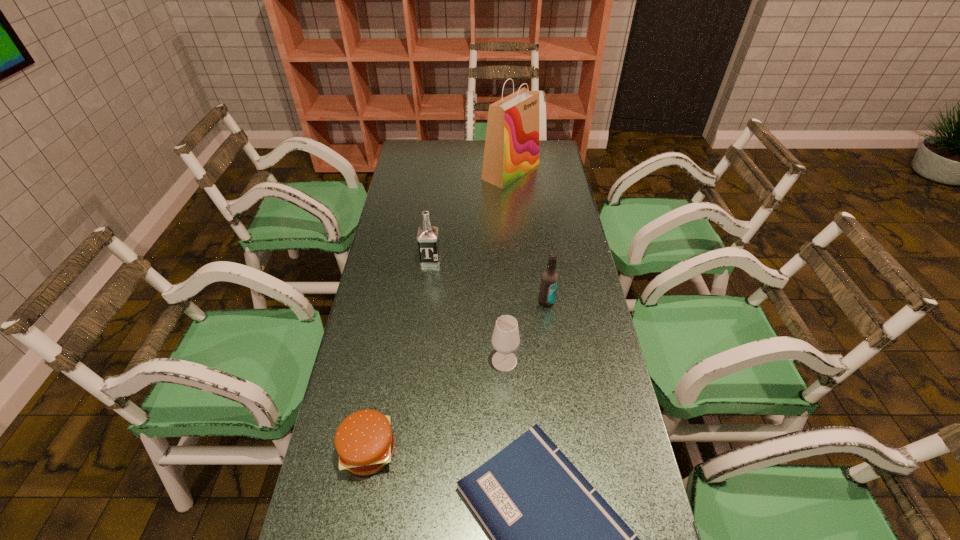
What are the coordinates of `free spot located on the back of the third shortest object` in the screenshot? It's located at 502,310.

You are a GUI agent. You are given a task and a screenshot of the screen. Output one action in this format:
    pyautogui.click(x=<x>, y=<y>)
    Task: Click on the free space located on the right of the hamburger
    The width and height of the screenshot is (960, 540).
    Given the screenshot: What is the action you would take?
    pyautogui.click(x=528, y=450)

You are a GUI agent. You are given a task and a screenshot of the screen. Output one action in this format:
    pyautogui.click(x=<x>, y=<y>)
    Task: Click on the object located at the far edge
    The height and width of the screenshot is (540, 960).
    Given the screenshot: What is the action you would take?
    pyautogui.click(x=511, y=149)

Locate an element on the screen. The height and width of the screenshot is (540, 960). vodka present at the left edge is located at coordinates (428, 241).

Where is `hamburger present at the left edge`? The height and width of the screenshot is (540, 960). hamburger present at the left edge is located at coordinates coord(364,440).

This screenshot has width=960, height=540. Identify the location of shopping bag situated at the right edge. (511, 149).

Identify the location of beer bottle that is at the right edge. (549, 281).

What are the coordinates of `object present at the far right corner` in the screenshot? It's located at (511, 149).

Locate an element on the screen. vacant space at the left edge of the desktop is located at coordinates (378, 319).

Find the location of a particular element. This screenshot has height=540, width=960. vacant space at the right edge of the desktop is located at coordinates (564, 218).